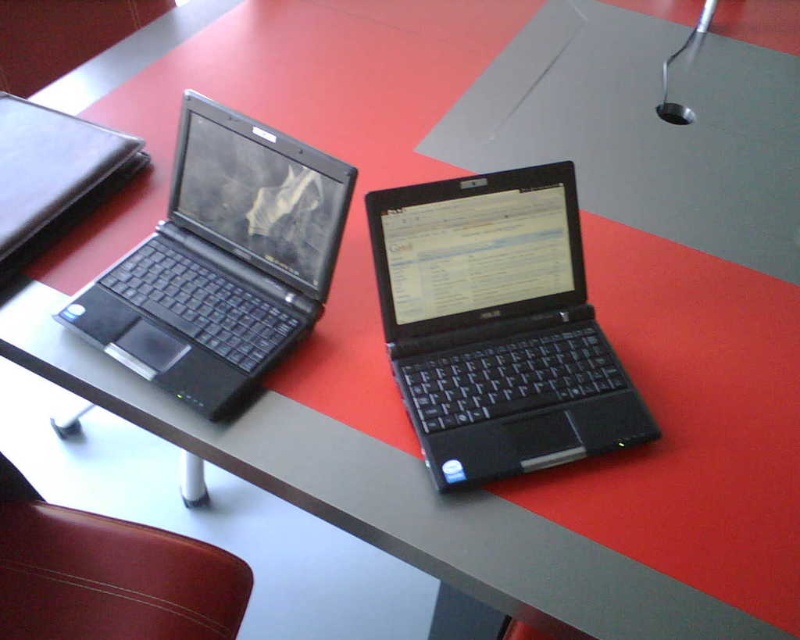
You are setting up a display on the table and need to place a tall decorative item. Which object between the matte black laptop at left and the leather at lower left should you place the item on top of?

The matte black laptop at left is much taller than the leather at lower left, so you should place the tall decorative item on top of the matte black laptop at left.

You are organizing a presentation and need to move the black plastic laptop at center to the back of the table. Can you place it behind the leather at lower left without moving the leather?

Yes, the black plastic laptop at center can be placed behind the leather at lower left because it is currently in front of it, so moving it to the back would position it behind the leather.